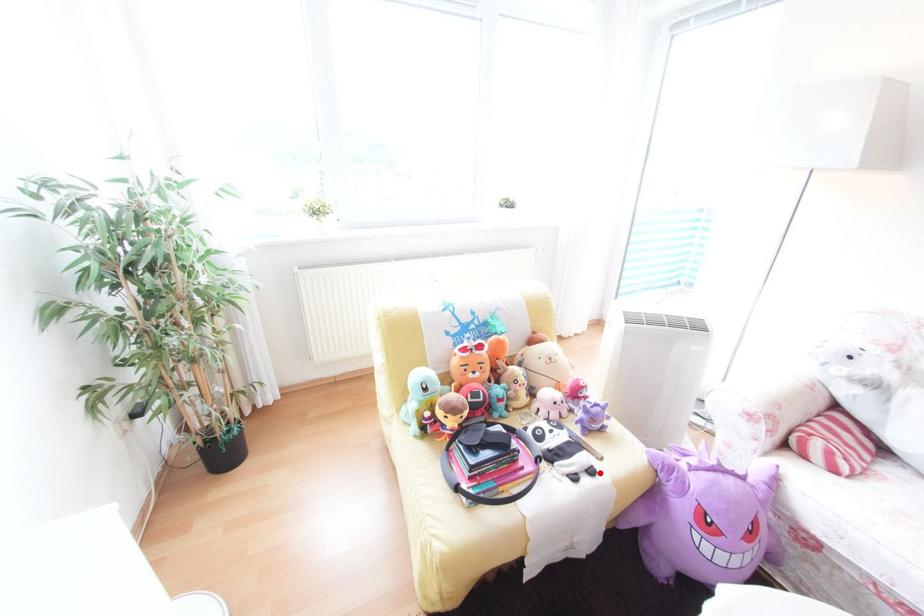
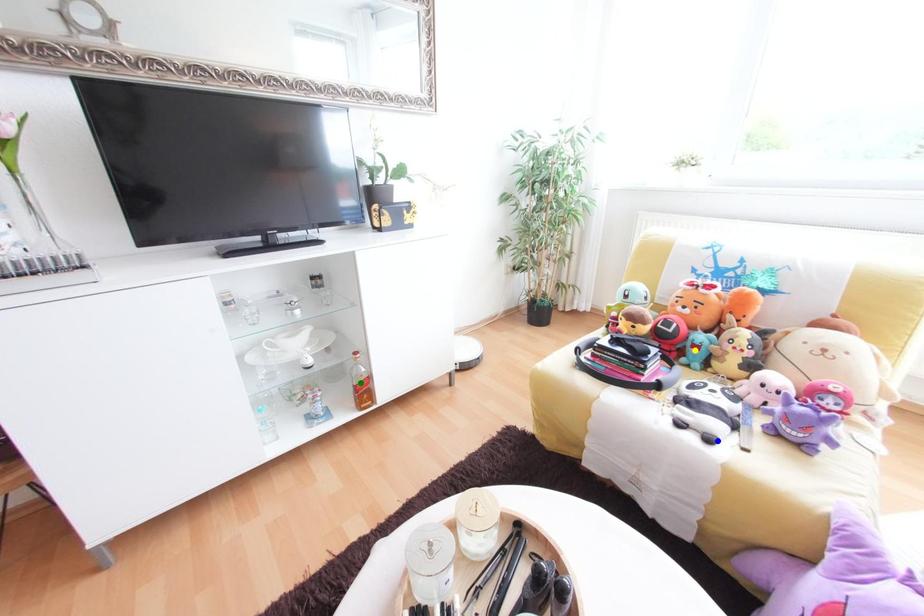
Question: I am providing you with two images of the same scene from different viewpoints. A red point is marked on the first image. You are given multiple points on the second image. In image 2, which mark is for the same physical point as the one in image 1?

Choices:
 (A) blue point
 (B) yellow point
 (C) green point

Answer: (A)